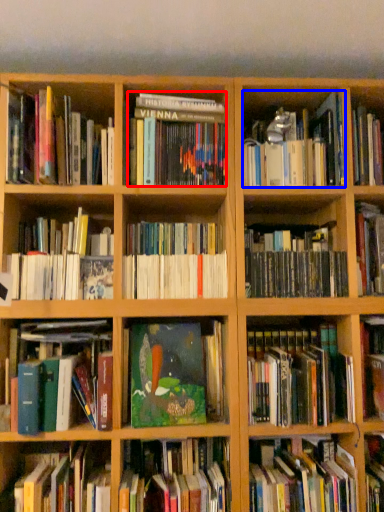
Question: Which of the following is the closest to the observer, book (highlighted by a red box) or book (highlighted by a blue box)?

Choices:
 (A) book
 (B) book

Answer: (B)